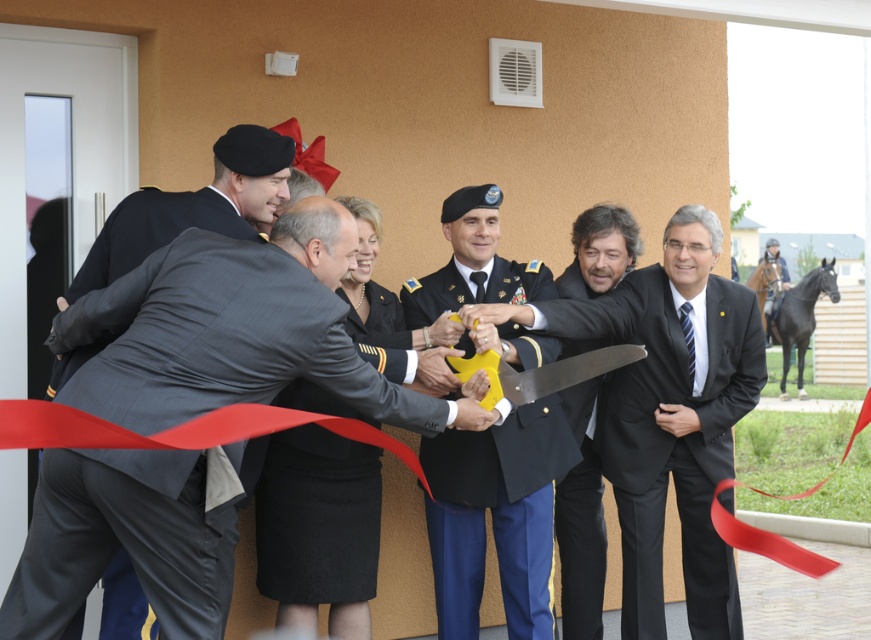
Question: Which point is farther from the camera taking this photo?

Choices:
 (A) (534, 573)
 (B) (146, 509)
 (C) (125, 204)
 (D) (515, 320)

Answer: (D)

Question: Is matte black suit at center to the right of matte black suit at left from the viewer's perspective?

Choices:
 (A) no
 (B) yes

Answer: (B)

Question: Which point is closer to the camera taking this photo?

Choices:
 (A) (466, 509)
 (B) (34, 513)

Answer: (B)

Question: Can you confirm if uniformed military officer at center is bigger than matte black suit at left?

Choices:
 (A) no
 (B) yes

Answer: (B)

Question: Which is farther from the matte black suit at left?

Choices:
 (A) uniformed military officer at center
 (B) matte gray suit at center

Answer: (A)

Question: Can you confirm if matte black suit at center is smaller than red fabric ribbon at center?

Choices:
 (A) yes
 (B) no

Answer: (B)